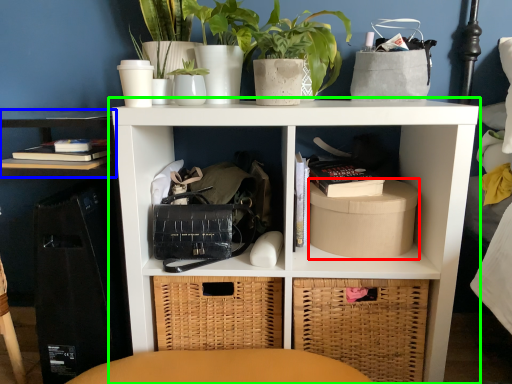
Question: Considering the real-world distances, which object is closest to cardboard box (highlighted by a red box)? shelf (highlighted by a blue box) or shelf (highlighted by a green box).

Choices:
 (A) shelf
 (B) shelf

Answer: (B)